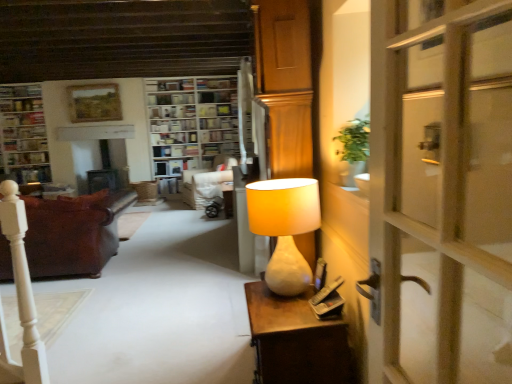
Question: Does matte white lamp at right lie in front of white marble desk at right?

Choices:
 (A) yes
 (B) no

Answer: (B)

Question: From a real-world perspective, is matte white lamp at right positioned over white marble desk at right based on gravity?

Choices:
 (A) no
 (B) yes

Answer: (B)

Question: Is matte white lamp at right taller than white marble desk at right?

Choices:
 (A) yes
 (B) no

Answer: (B)

Question: Can you confirm if matte white lamp at right is shorter than white marble desk at right?

Choices:
 (A) no
 (B) yes

Answer: (B)

Question: Does matte white lamp at right turn towards white marble desk at right?

Choices:
 (A) no
 (B) yes

Answer: (A)

Question: Is wooden bookshelf at center taller or shorter than white paper bookshelf at upper center, the first book in the top-to-bottom sequence?

Choices:
 (A) short
 (B) tall

Answer: (B)

Question: Is point (178, 185) positioned closer to the camera than point (177, 129)?

Choices:
 (A) closer
 (B) farther

Answer: (B)

Question: In the image, is wooden bookshelf at center positioned in front of or behind white paper bookshelf at upper center, which is the second book in bottom-to-top order?

Choices:
 (A) front
 (B) behind

Answer: (A)

Question: Looking at the image, does wooden bookshelf at center seem bigger or smaller compared to white paper bookshelf at upper center, the 1th book from the right?

Choices:
 (A) small
 (B) big

Answer: (B)

Question: In terms of height, does white marble desk at right look taller or shorter compared to wooden bookshelf at upper left?

Choices:
 (A) tall
 (B) short

Answer: (B)

Question: Would you say white marble desk at right is to the left or to the right of wooden bookshelf at upper left in the picture?

Choices:
 (A) right
 (B) left

Answer: (A)

Question: Choose the correct answer: Is white marble desk at right inside wooden bookshelf at upper left or outside it?

Choices:
 (A) outside
 (B) inside

Answer: (A)

Question: From a real-world perspective, is white marble desk at right above or below wooden bookshelf at upper left?

Choices:
 (A) below
 (B) above

Answer: (A)

Question: In terms of size, does white fabric chair at center appear bigger or smaller than wooden bookshelf at center?

Choices:
 (A) big
 (B) small

Answer: (B)

Question: Considering the positions of white fabric chair at center and wooden bookshelf at center in the image, is white fabric chair at center taller or shorter than wooden bookshelf at center?

Choices:
 (A) tall
 (B) short

Answer: (B)